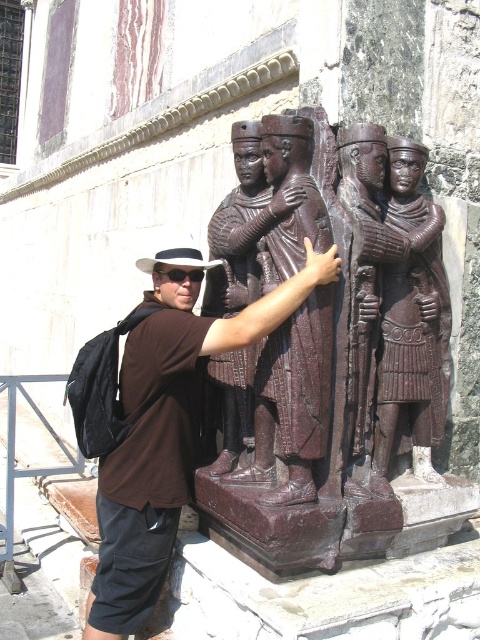
You are standing in front of the sculpture and notice two points marked on it. The first point is at coordinates point (374, 332) and the second is at point (144, 342). Which of these points is closer to your viewpoint?

Point (374, 332) is closer to the camera than point (144, 342).

You are standing at the point with coordinates point (312, 134) and want to walk to point (203, 275). Which direction should you move?

Since point (312, 134) is in front of point (203, 275), you should move backward to reach point (203, 275).